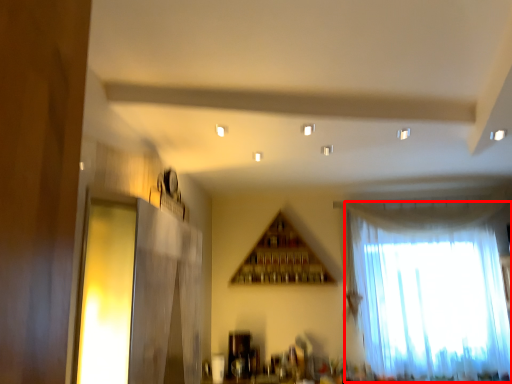
Question: In this image, where is curtain (annotated by the red box) located relative to window?

Choices:
 (A) left
 (B) right

Answer: (B)